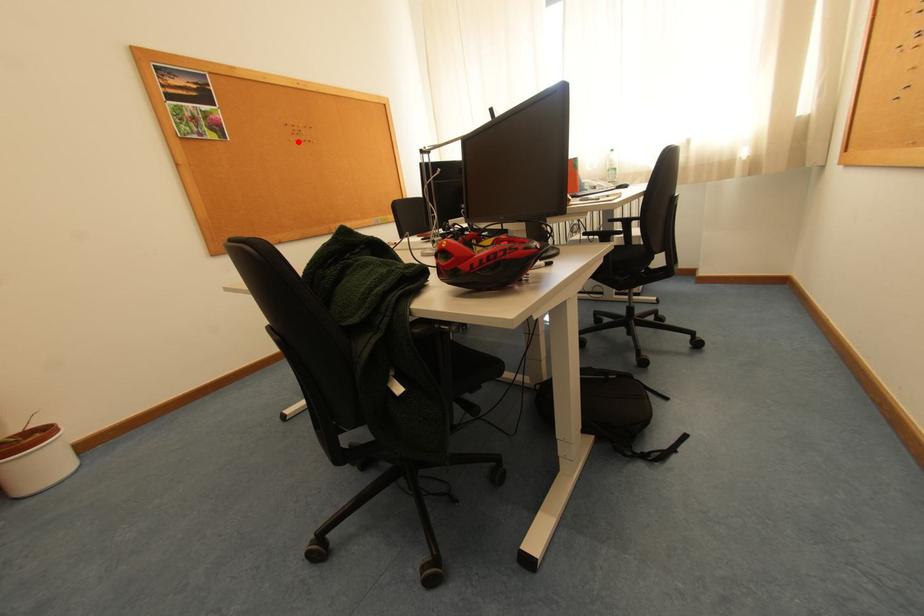
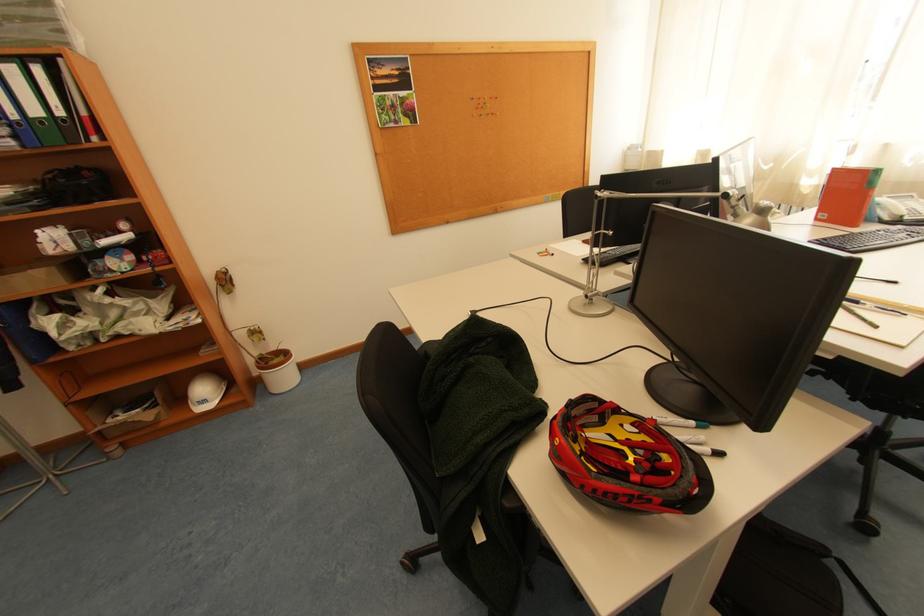
Locate, in the second image, the point that corresponds to the highlighted location in the first image.

(481, 118)